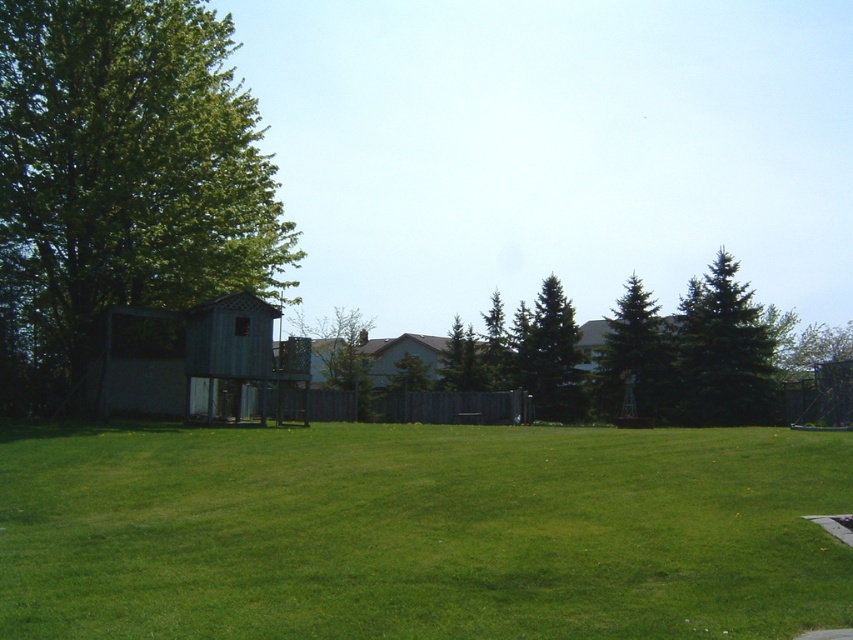
Who is higher up, green grass at center or green leafy tree at left?

green leafy tree at left is above.

Between green grass at center and green leafy tree at left, which one has more height?

green leafy tree at left is taller.

Find the location of `green grass at center`. green grass at center is located at coordinates tap(419, 531).

Is green needle-like tree at right to the right of green textured pine tree at center from the viewer's perspective?

Indeed, green needle-like tree at right is positioned on the right side of green textured pine tree at center.

Who is lower down, green needle-like tree at right or green textured pine tree at center?

green textured pine tree at center is below.

Which is in front, point (699, 282) or point (532, 344)?

Positioned in front is point (699, 282).

You are a GUI agent. You are given a task and a screenshot of the screen. Output one action in this format:
    pyautogui.click(x=<x>, y=<y>)
    Task: Click on the green needle-like tree at right
    
    Given the screenshot: What is the action you would take?
    pyautogui.click(x=722, y=353)

Consider the image. Does green leafy tree at left appear over green textured pine tree at center?

Yes.

Consider the image. Which is more to the left, green leafy tree at left or green textured pine tree at center?

green leafy tree at left is more to the left.

Find the location of a particular element. This screenshot has height=640, width=853. green leafy tree at left is located at coordinates (120, 179).

Image resolution: width=853 pixels, height=640 pixels. I want to click on green leafy tree at left, so click(x=120, y=179).